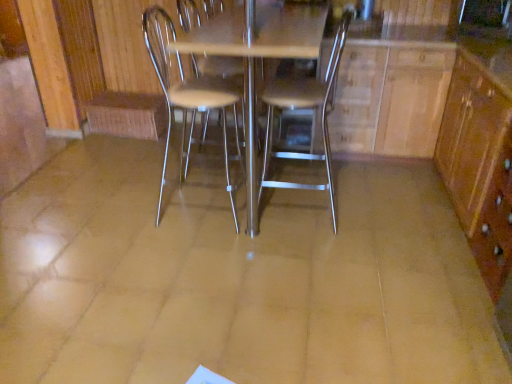
Locate an element on the screen. The height and width of the screenshot is (384, 512). free space to the left of metallic silver table at center is located at coordinates (96, 208).